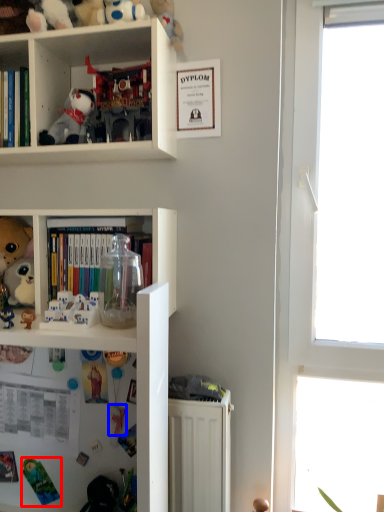
Question: Which point is closer to the camera, toy (highlighted by a red box) or toy (highlighted by a blue box)?

Choices:
 (A) toy
 (B) toy

Answer: (B)